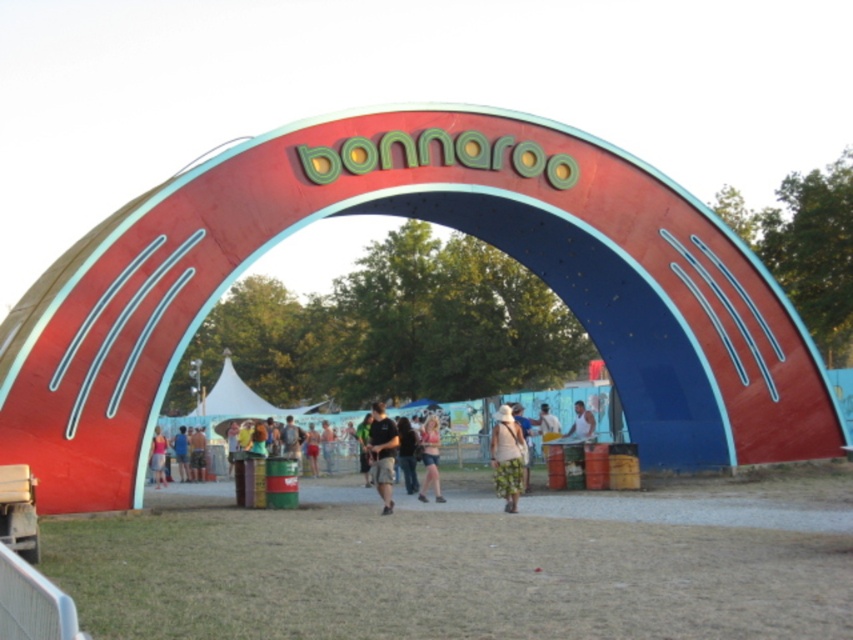
You are at the Bonnaroo festival and want to take a photo of the denim shorts at center and the light brown wooden table at center. Which object should you zoom in on to capture both in the frame without moving your camera?

You should zoom in on the light brown wooden table at center because it is smaller than the denim shorts at center, allowing both to fit within the camera frame without moving.

You are a photographer at the Bonnaroo festival and want to capture both the matte pink shorts at center and the denim shorts at center in a single photo. Since you can only focus on one subject at a time, which pair of shorts should you focus on to ensure the other remains in the background?

You should focus on the matte pink shorts at center because the denim shorts at center are behind it, so keeping the matte pink shorts in focus will naturally place the denim shorts in the background.